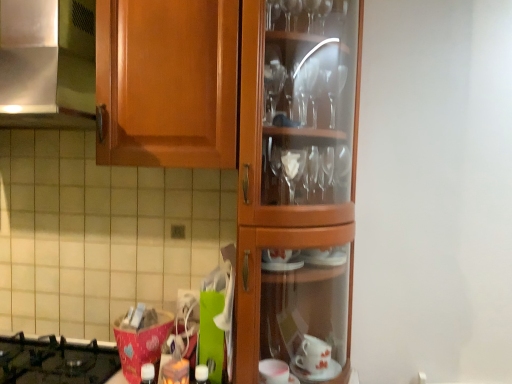
Question: Is white matte bottle at center further to camera compared to black glass gas stove at lower left?

Choices:
 (A) no
 (B) yes

Answer: (A)

Question: Is white matte bottle at center aimed at black glass gas stove at lower left?

Choices:
 (A) yes
 (B) no

Answer: (B)

Question: Can you confirm if white matte bottle at center is bigger than black glass gas stove at lower left?

Choices:
 (A) no
 (B) yes

Answer: (A)

Question: Does white matte bottle at center have a greater height compared to black glass gas stove at lower left?

Choices:
 (A) no
 (B) yes

Answer: (B)

Question: Does white matte bottle at center have a greater width compared to black glass gas stove at lower left?

Choices:
 (A) no
 (B) yes

Answer: (A)

Question: Does white matte bottle at center have a smaller size compared to black glass gas stove at lower left?

Choices:
 (A) yes
 (B) no

Answer: (A)

Question: Is the surface of satin silver metal at upper left in direct contact with white matte bottle at center?

Choices:
 (A) no
 (B) yes

Answer: (A)

Question: Considering the relative sizes of satin silver metal at upper left and white matte bottle at center in the image provided, is satin silver metal at upper left thinner than white matte bottle at center?

Choices:
 (A) no
 (B) yes

Answer: (A)

Question: Can you confirm if satin silver metal at upper left is positioned to the right of white matte bottle at center?

Choices:
 (A) no
 (B) yes

Answer: (A)

Question: Can you confirm if satin silver metal at upper left is shorter than white matte bottle at center?

Choices:
 (A) yes
 (B) no

Answer: (B)

Question: Is satin silver metal at upper left taller than white matte bottle at center?

Choices:
 (A) yes
 (B) no

Answer: (A)

Question: From the image's perspective, is satin silver metal at upper left located beneath white matte bottle at center?

Choices:
 (A) yes
 (B) no

Answer: (B)

Question: Is satin silver metal at upper left further to camera compared to black glass gas stove at lower left?

Choices:
 (A) no
 (B) yes

Answer: (A)